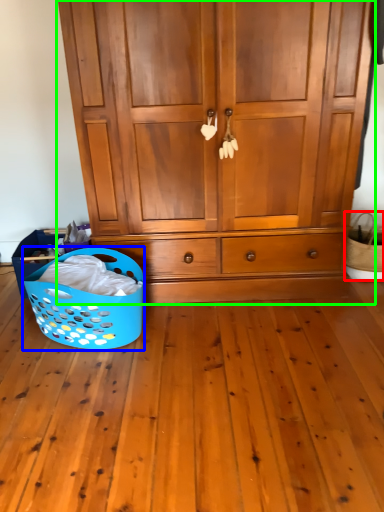
Question: Which object is the farthest from basket (highlighted by a red box)? Choose among these: basket (highlighted by a blue box) or cupboard (highlighted by a green box).

Choices:
 (A) basket
 (B) cupboard

Answer: (A)